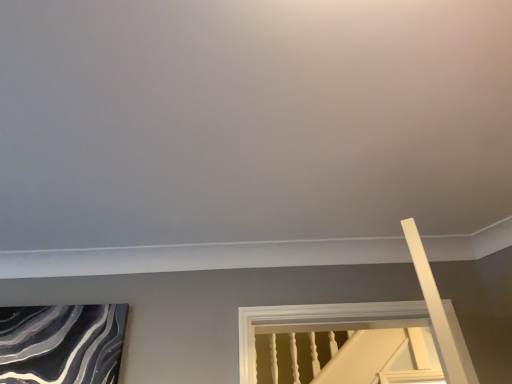
What do you see at coordinates (62, 344) in the screenshot? Image resolution: width=512 pixels, height=384 pixels. I see `black agate painting at lower left` at bounding box center [62, 344].

This screenshot has width=512, height=384. In order to click on black agate painting at lower left in this screenshot , I will do `click(62, 344)`.

Where is `black agate painting at lower left`? The height and width of the screenshot is (384, 512). black agate painting at lower left is located at coordinates (x=62, y=344).